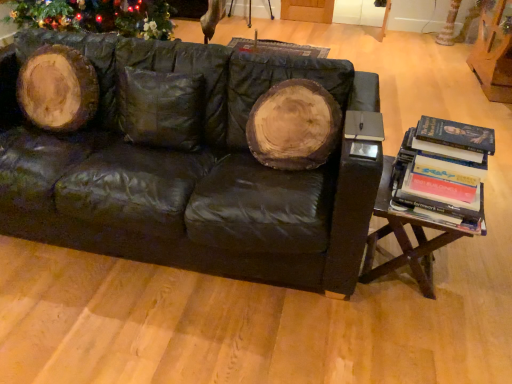
What are the coordinates of `free space above matte black book at right (from a real-world perspective)` in the screenshot? It's located at (355, 123).